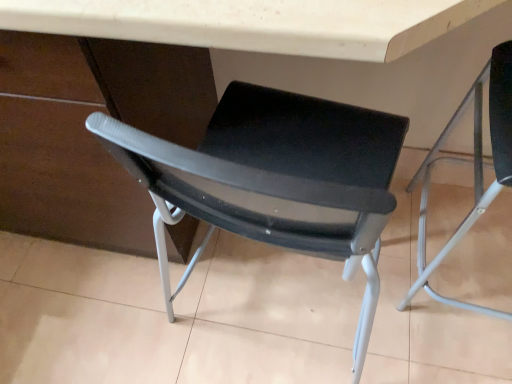
Question: Is there a large distance between black mesh chair at center, marked as the second chair in a right-to-left arrangement, and matte plastic table at center?

Choices:
 (A) yes
 (B) no

Answer: (B)

Question: Does black mesh chair at center, marked as the second chair in a right-to-left arrangement, come in front of matte plastic table at center?

Choices:
 (A) no
 (B) yes

Answer: (A)

Question: From the image's perspective, is black mesh chair at center, which appears as the 1th chair when viewed from the left, on matte plastic table at center?

Choices:
 (A) no
 (B) yes

Answer: (A)

Question: Is black mesh chair at center, which appears as the 1th chair when viewed from the left, next to matte plastic table at center?

Choices:
 (A) yes
 (B) no

Answer: (B)

Question: Is black mesh chair at center, which appears as the 1th chair when viewed from the left, turned away from matte plastic table at center?

Choices:
 (A) yes
 (B) no

Answer: (B)

Question: Does black mesh chair at center, which appears as the 1th chair when viewed from the left, have a lesser width compared to matte plastic table at center?

Choices:
 (A) yes
 (B) no

Answer: (B)

Question: Is matte plastic table at center completely or partially outside of black mesh chair at center, marked as the second chair in a right-to-left arrangement?

Choices:
 (A) no
 (B) yes

Answer: (B)

Question: Is matte plastic table at center facing away from black mesh chair at center, which appears as the 1th chair when viewed from the left?

Choices:
 (A) yes
 (B) no

Answer: (B)

Question: From the image's perspective, is matte plastic table at center below black mesh chair at center, marked as the second chair in a right-to-left arrangement?

Choices:
 (A) no
 (B) yes

Answer: (A)

Question: Could you tell me if matte plastic table at center is turned towards black mesh chair at center, marked as the second chair in a right-to-left arrangement?

Choices:
 (A) yes
 (B) no

Answer: (B)

Question: Is matte plastic table at center at the right side of black mesh chair at center, which appears as the 1th chair when viewed from the left?

Choices:
 (A) no
 (B) yes

Answer: (A)

Question: Would you say black mesh chair at center, which appears as the 1th chair when viewed from the left, is part of matte plastic table at center's contents?

Choices:
 (A) no
 (B) yes

Answer: (A)

Question: Is black mesh chair at center, which appears as the 1th chair when viewed from the left, to the right of matte black chair at right, the first chair when ordered from right to left, from the viewer's perspective?

Choices:
 (A) no
 (B) yes

Answer: (A)